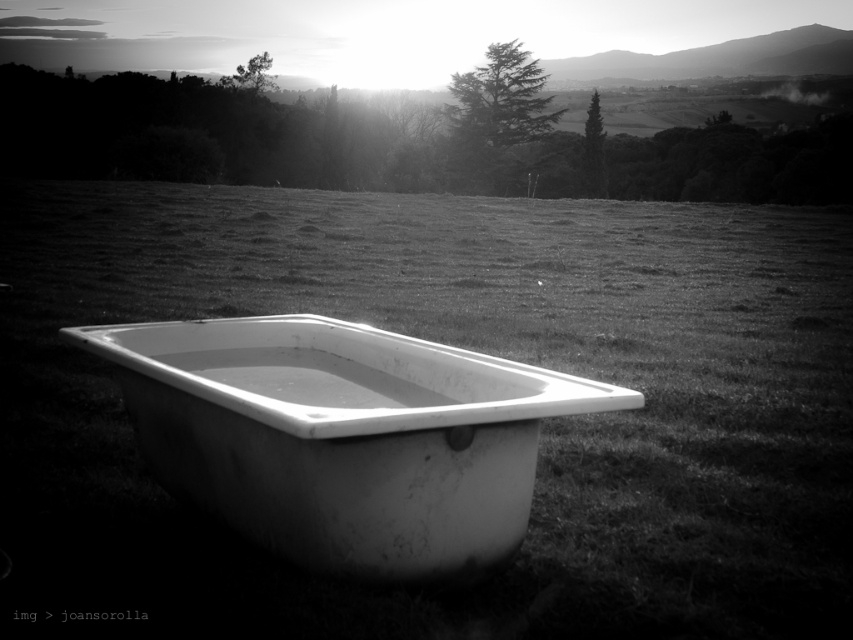
Can you confirm if smooth grass at center is thinner than white matte bathtub at center?

No.

Between point (622, 481) and point (189, 339), which one is positioned in front?

Positioned in front is point (189, 339).

Measure the distance between point (717, 205) and camera.

24.55 meters

The width and height of the screenshot is (853, 640). I want to click on smooth grass at center, so pos(469,348).